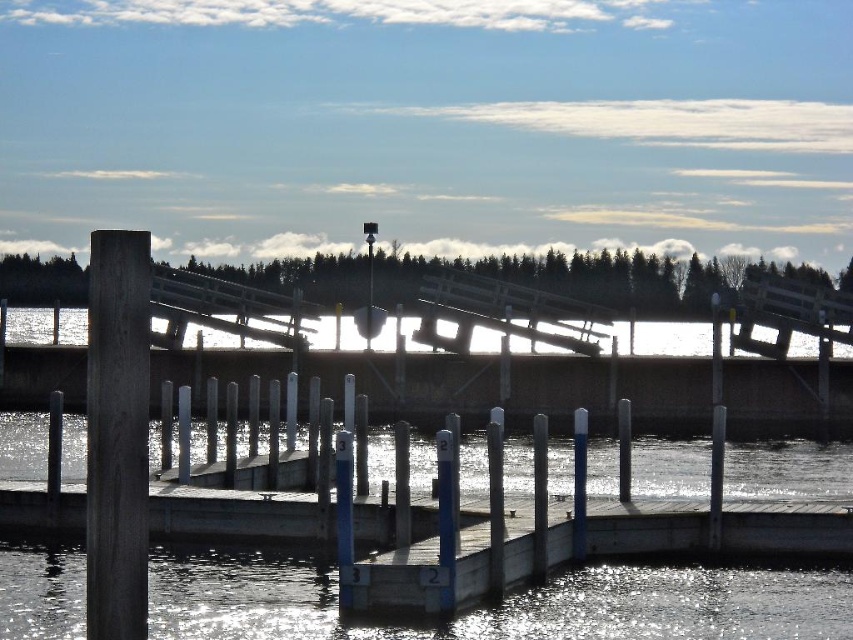
Which is more to the left, clear water at dock center or dark wood post at left?

Positioned to the left is dark wood post at left.

Does clear water at dock center appear on the right side of dark wood post at left?

Yes, clear water at dock center is to the right of dark wood post at left.

At what (x,y) coordinates should I click in order to perform the action: click on clear water at dock center. Please return your answer as a coordinate pair (x, y). Looking at the image, I should click on (500, 604).